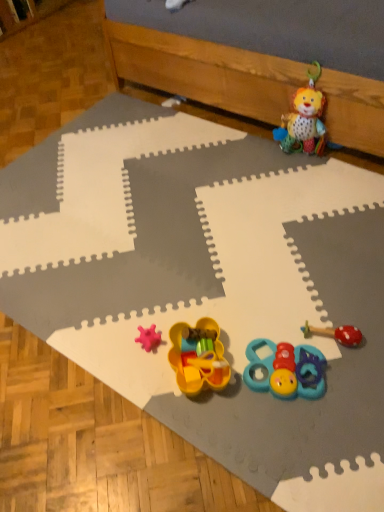
This screenshot has height=512, width=384. In order to click on free spot to the left of plush fabric lion at upper right, the 4th toy in the front-to-back sequence in this screenshot , I will do `click(255, 157)`.